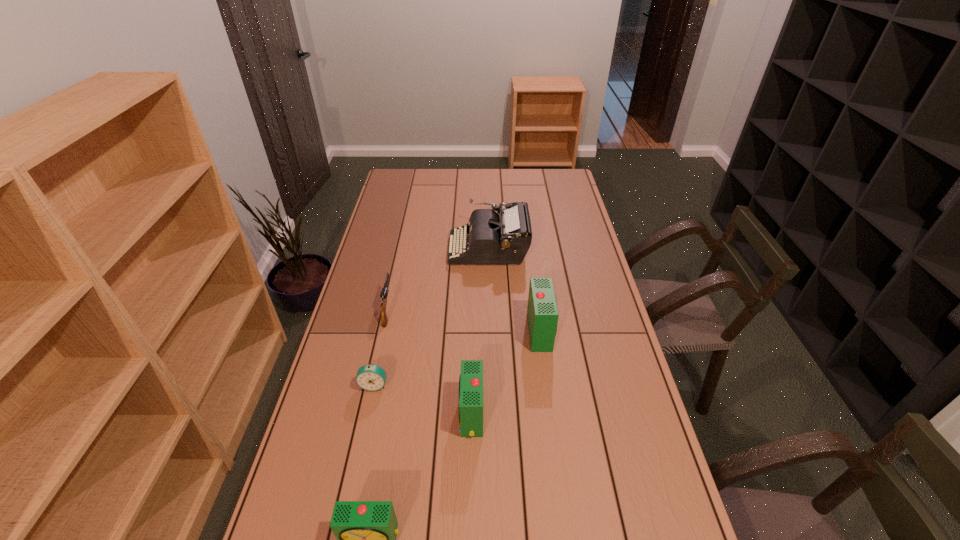
In the current image, all alarm clocks are evenly spaced. To maintain this equal spacing, where should an additional alarm clock be placed on the right? Please point out a free spot. Please provide its 2D coordinates. Your answer should be formatted as a tuple, i.e. [(x, y)], where the tuple contains the x and y coordinates of a point satisfying the conditions above.

[(589, 271)]